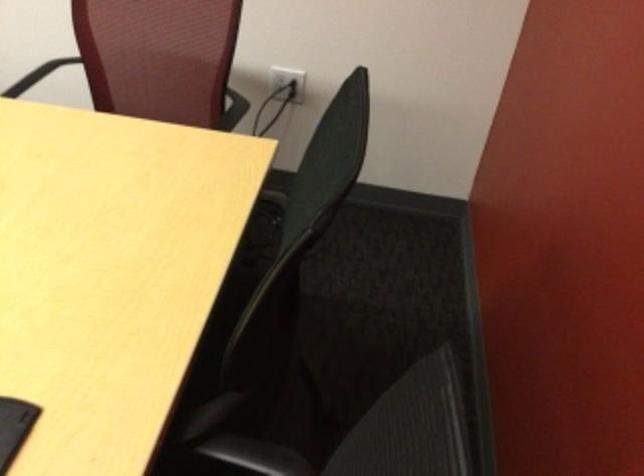
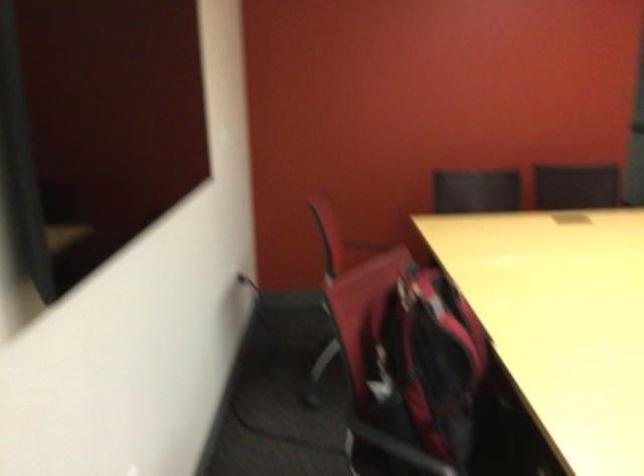
Question: I am providing you with two images of the same scene from different viewpoints. Which of the following objects are not visible in image2?

Choices:
 (A) white plastic colander
 (B) white electrical outlet
 (C) black chair armrest
 (D) red and black backpack

Answer: (B)